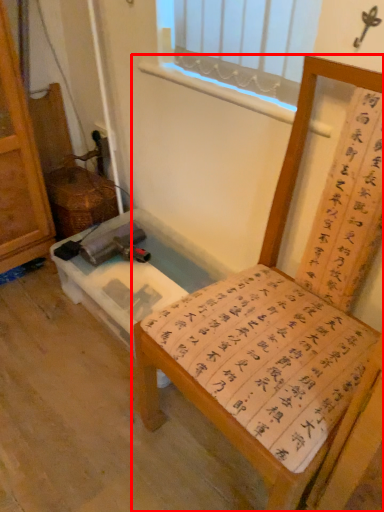
Question: From the image, what is the correct spatial relationship of furniture (annotated by the red box) in relation to vanity?

Choices:
 (A) right
 (B) left

Answer: (A)